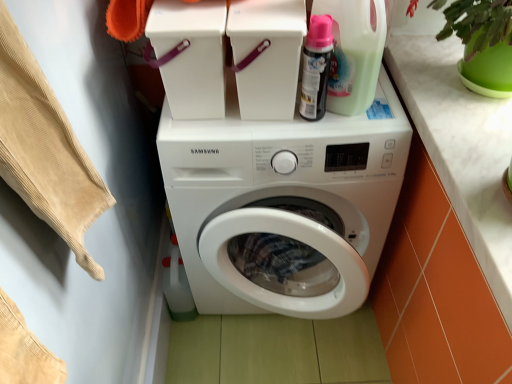
Question: Considering the relative positions of white marble countertop at upper right and white plastic container at upper center in the image provided, is white marble countertop at upper right to the left of white plastic container at upper center from the viewer's perspective?

Choices:
 (A) yes
 (B) no

Answer: (B)

Question: Is white marble countertop at upper right far away from white plastic container at upper center?

Choices:
 (A) yes
 (B) no

Answer: (B)

Question: From a real-world perspective, is white marble countertop at upper right positioned over white plastic container at upper center based on gravity?

Choices:
 (A) no
 (B) yes

Answer: (A)

Question: Considering the relative positions of white marble countertop at upper right and white plastic container at upper center in the image provided, is white marble countertop at upper right to the right of white plastic container at upper center from the viewer's perspective?

Choices:
 (A) yes
 (B) no

Answer: (A)

Question: From the image's perspective, does white marble countertop at upper right appear lower than white plastic container at upper center?

Choices:
 (A) yes
 (B) no

Answer: (A)

Question: Would you say white marble countertop at upper right is inside or outside white plastic container at upper center?

Choices:
 (A) inside
 (B) outside

Answer: (B)

Question: From their relative heights in the image, would you say white marble countertop at upper right is taller or shorter than white plastic container at upper center?

Choices:
 (A) tall
 (B) short

Answer: (B)

Question: In the image, is white marble countertop at upper right positioned in front of or behind white plastic container at upper center?

Choices:
 (A) front
 (B) behind

Answer: (A)

Question: Is white marble countertop at upper right wider or thinner than white plastic container at upper center?

Choices:
 (A) thin
 (B) wide

Answer: (B)

Question: Is point click(x=415, y=112) closer or farther from the camera than point click(x=305, y=81)?

Choices:
 (A) farther
 (B) closer

Answer: (A)

Question: Is white marble countertop at upper right in front of or behind matte black spray can at upper right, which is counted as the second cleaning product, starting from the right, in the image?

Choices:
 (A) behind
 (B) front

Answer: (B)

Question: From the image's perspective, is white marble countertop at upper right positioned above or below matte black spray can at upper right, which is counted as the second cleaning product, starting from the right?

Choices:
 (A) below
 (B) above

Answer: (A)

Question: From a real-world perspective, is white marble countertop at upper right physically located above or below matte black spray can at upper right, which is counted as the second cleaning product, starting from the right?

Choices:
 (A) above
 (B) below

Answer: (B)

Question: Choose the correct answer: Is beige corduroy fabric at left inside matte black spray can at upper right, the first cleaning product viewed from the left, or outside it?

Choices:
 (A) outside
 (B) inside

Answer: (A)

Question: Is point (72, 225) closer or farther from the camera than point (322, 82)?

Choices:
 (A) closer
 (B) farther

Answer: (A)